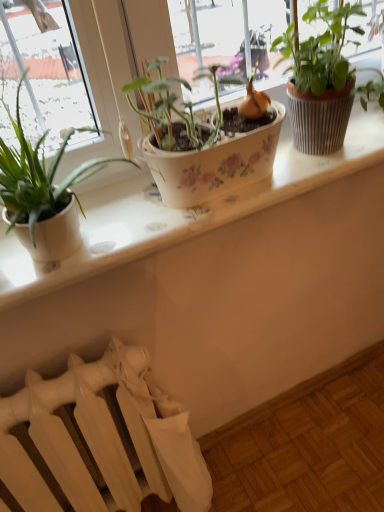
This screenshot has height=512, width=384. Identify the location of free space below white ceramic window sill at center (from a real-world perspective). (282, 428).